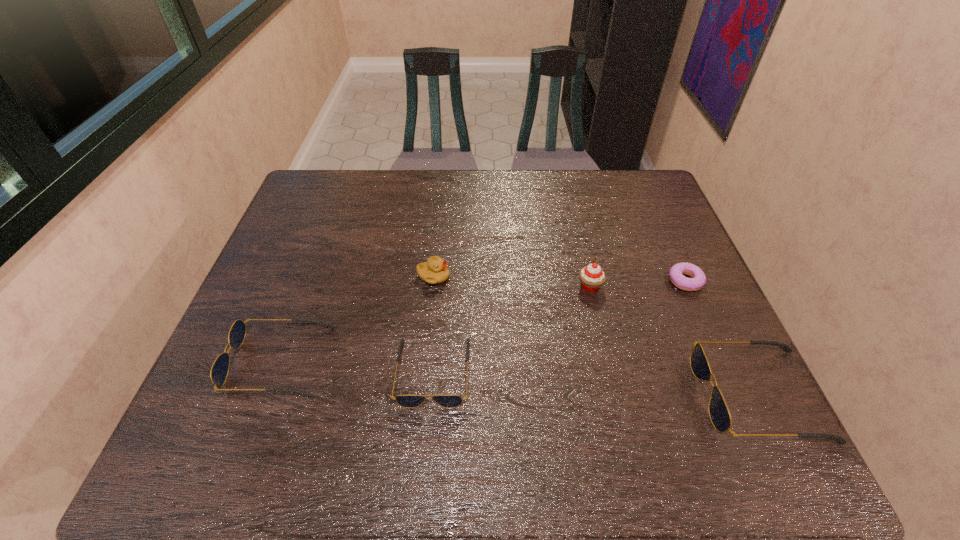
Find the location of a particular element. The image size is (960, 540). free space located on the front-facing side of the rightmost sunglasses is located at coordinates (564, 395).

Where is `free spot located on the front-facing side of the rightmost sunglasses`? free spot located on the front-facing side of the rightmost sunglasses is located at coordinates (578, 395).

Find the location of `vacant space located on the right of the tallest object`. vacant space located on the right of the tallest object is located at coordinates (694, 286).

Find the location of a particular element. The width and height of the screenshot is (960, 540). free spot located 0.300m on the left of the shortest object is located at coordinates (555, 281).

Identify the location of free space located 0.380m on the front-facing side of the duckling. This screenshot has width=960, height=540. (591, 276).

Locate an element on the screen. The width and height of the screenshot is (960, 540). object situated at the left edge is located at coordinates (219, 371).

The image size is (960, 540). Identify the location of sunglasses present at the right edge. (719, 413).

The image size is (960, 540). I want to click on doughnut positioned at the right edge, so click(698, 279).

Find the location of a particular element. object positioned at the near left corner is located at coordinates (219, 371).

What are the coordinates of `object located in the near right corner section of the desktop` in the screenshot? It's located at (719, 413).